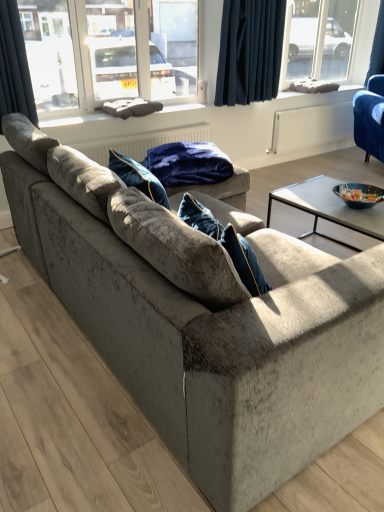
Question: Should I look upward or downward to see gray fabric cushion at center, the first window sill from the left?

Choices:
 (A) up
 (B) down

Answer: (A)

Question: Should I look upward or downward to see dark blue velvet curtain at upper left, arranged as the 1th curtain when viewed from the left?

Choices:
 (A) down
 (B) up

Answer: (B)

Question: Could you tell me if dark blue fabric at upper center, which is the second curtain in front-to-back order, is facing velvet blue blanket at center?

Choices:
 (A) no
 (B) yes

Answer: (A)

Question: Can you confirm if dark blue fabric at upper center, which is the 2th curtain in left-to-right order, is smaller than velvet blue blanket at center?

Choices:
 (A) no
 (B) yes

Answer: (B)

Question: Does dark blue fabric at upper center, which appears as the second curtain when viewed from the back, have a lesser height compared to velvet blue blanket at center?

Choices:
 (A) no
 (B) yes

Answer: (A)

Question: Is velvet blue blanket at center located within dark blue fabric at upper center, which is the 2th curtain in left-to-right order?

Choices:
 (A) yes
 (B) no

Answer: (B)

Question: Would you say dark blue fabric at upper center, which is the second curtain in front-to-back order, is outside velvet blue blanket at center?

Choices:
 (A) yes
 (B) no

Answer: (A)

Question: Is dark blue fabric at upper center, acting as the 2th curtain starting from the right, not close to velvet blue blanket at center?

Choices:
 (A) no
 (B) yes

Answer: (B)

Question: Considering the relative sizes of dark blue velvet curtain at upper right, which ranks as the first curtain in right-to-left order, and velvet blue blanket at center in the image provided, is dark blue velvet curtain at upper right, which ranks as the first curtain in right-to-left order, taller than velvet blue blanket at center?

Choices:
 (A) no
 (B) yes

Answer: (B)

Question: Is dark blue velvet curtain at upper right, marked as the third curtain in a left-to-right arrangement, facing towards velvet blue blanket at center?

Choices:
 (A) no
 (B) yes

Answer: (A)

Question: Can you confirm if dark blue velvet curtain at upper right, acting as the 3th curtain starting from the front, is wider than velvet blue blanket at center?

Choices:
 (A) yes
 (B) no

Answer: (B)

Question: Is dark blue velvet curtain at upper right, positioned as the 1th curtain in back-to-front order, further to the viewer compared to velvet blue blanket at center?

Choices:
 (A) no
 (B) yes

Answer: (B)

Question: Can you confirm if dark blue velvet curtain at upper right, which ranks as the first curtain in right-to-left order, is thinner than velvet blue blanket at center?

Choices:
 (A) no
 (B) yes

Answer: (B)

Question: Is velvet blue blanket at center located within dark blue velvet curtain at upper right, positioned as the 1th curtain in back-to-front order?

Choices:
 (A) yes
 (B) no

Answer: (B)

Question: Is there a large distance between blue fabric cushion at upper center, which is the second window sill in front-to-back order, and velvet blue blanket at center?

Choices:
 (A) yes
 (B) no

Answer: (A)